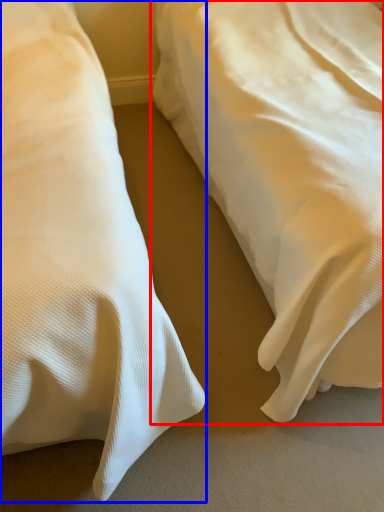
Question: Which point is closer to the camera, bed (highlighted by a red box) or bed (highlighted by a blue box)?

Choices:
 (A) bed
 (B) bed

Answer: (B)